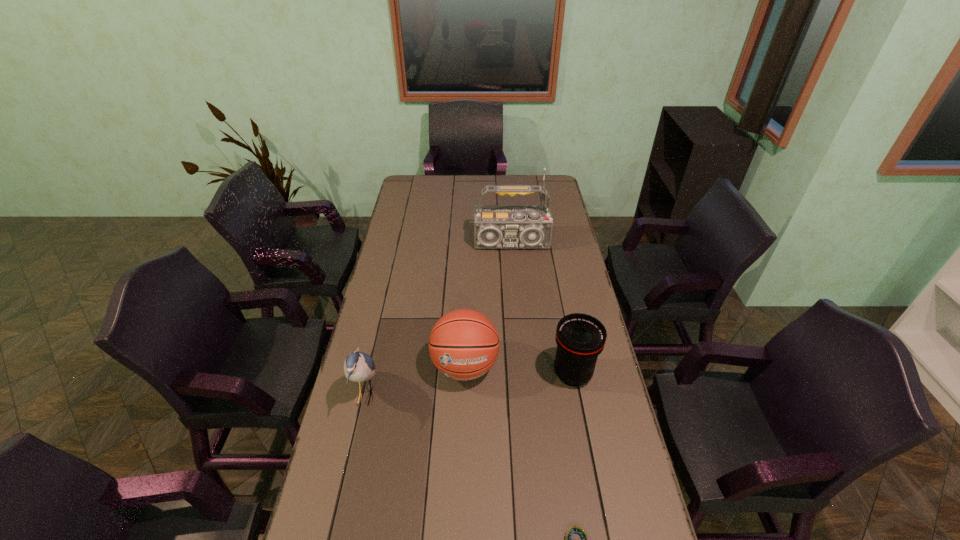
Where is `radio receiver that is at the right edge`? radio receiver that is at the right edge is located at coordinates (495, 226).

At what (x,y) coordinates should I click in order to perform the action: click on telephoto lens that is positioned at the right edge. Please return your answer as a coordinate pair (x, y). The width and height of the screenshot is (960, 540). Looking at the image, I should click on (580, 338).

This screenshot has height=540, width=960. I want to click on free space at the far edge, so click(447, 186).

The width and height of the screenshot is (960, 540). I want to click on free region at the left edge of the desktop, so click(422, 249).

Where is `vacant region at the right edge of the desktop`? vacant region at the right edge of the desktop is located at coordinates (563, 229).

You are a GUI agent. You are given a task and a screenshot of the screen. Output one action in this format:
    pyautogui.click(x=<x>, y=<y>)
    Task: Click on the free space at the far right corner of the desktop
    The height and width of the screenshot is (540, 960).
    Given the screenshot: What is the action you would take?
    pyautogui.click(x=555, y=198)

Locate an element on the screen. This screenshot has height=540, width=960. free space between the radio receiver and the telephoto lens is located at coordinates (542, 310).

Find the location of a particular element. The image size is (960, 540). blank region between the bird and the telephoto lens is located at coordinates (468, 384).

Select which object appears as the second closest to the basketball. Please provide its 2D coordinates. Your answer should be formatted as a tuple, i.e. [(x, y)], where the tuple contains the x and y coordinates of a point satisfying the conditions above.

[(580, 338)]

The height and width of the screenshot is (540, 960). In order to click on object that can be found as the fourth closest to the bird in this screenshot , I will do `click(495, 226)`.